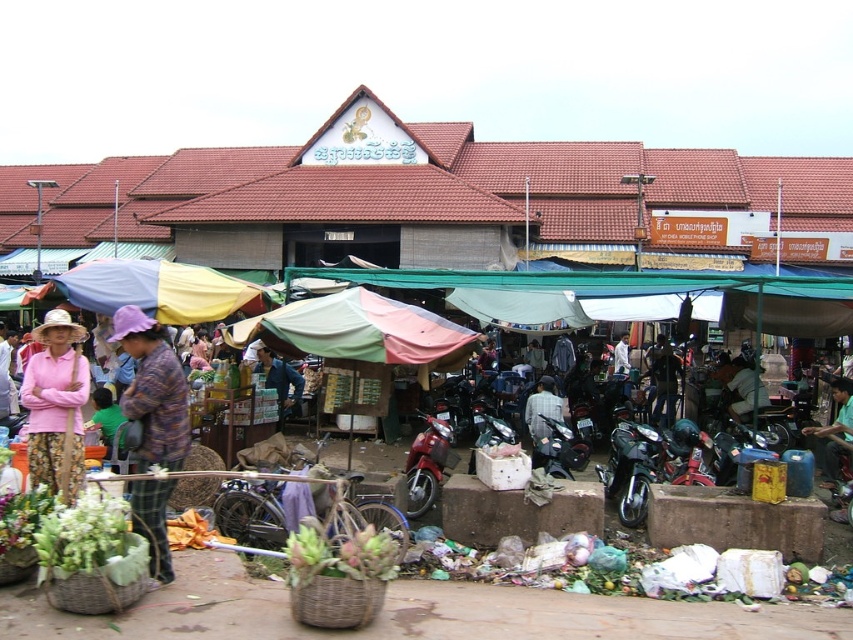
You are a delivery rider who needs to park your motorcycle near the baskets of fresh produce at the market. The baskets are in the foreground. Based on the scene, can you park your shiny black motorcycle at lower right closer to the baskets without blocking the main pathway?

The shiny black motorcycle at lower right is located at point (631, 468), which is near the baskets of fresh produce in the foreground. Since it is positioned there, it should be possible to park it closer to the baskets without obstructing the main pathway, provided there is enough space.

You are standing at the entrance of the market and notice a person wearing a dark blue fabric shirt at lower right. Where exactly is this person located in relation to the entrance?

The dark blue fabric shirt at lower right is located at point 0.673 on the x and 0.978 on the y coordinates, meaning it is positioned towards the right and lower part of the market area, closer to the bottom edge near the entrance.

You are a photographer trying to capture a shot of the purple fabric hat at left and the shiny black motorcycle at lower right in the same frame. Based on their positions, can you determine which object is higher in the image?

The purple fabric hat at left is above the shiny black motorcycle at lower right, so it is higher in the image.